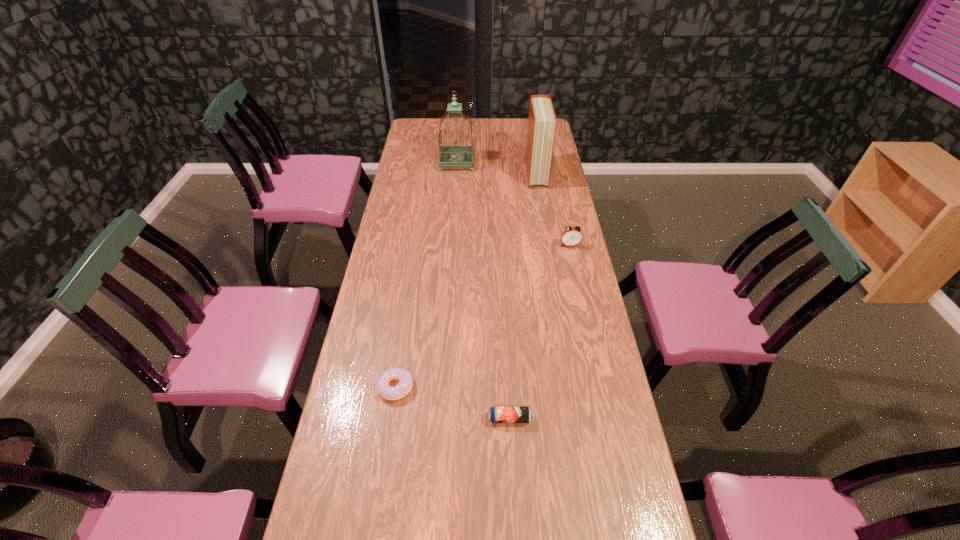
Find the location of a particular element. The height and width of the screenshot is (540, 960). birdcage is located at coordinates (451, 155).

This screenshot has height=540, width=960. In order to click on the second object from right to left in this screenshot , I will do `click(542, 121)`.

This screenshot has width=960, height=540. In order to click on alarm clock in this screenshot , I will do `click(572, 236)`.

The height and width of the screenshot is (540, 960). I want to click on the third farthest object, so click(x=572, y=236).

The width and height of the screenshot is (960, 540). In order to click on beer can in this screenshot , I will do `click(497, 414)`.

This screenshot has width=960, height=540. In order to click on the nearest object in this screenshot , I will do (497, 414).

Where is `doughnut`? This screenshot has width=960, height=540. doughnut is located at coordinates (405, 384).

Where is `free location located 0.070m at the door of the birdcage`? The image size is (960, 540). free location located 0.070m at the door of the birdcage is located at coordinates (489, 163).

Find the location of a particular element. The height and width of the screenshot is (540, 960). vacant space located on the open cover of the fourth object from left to right is located at coordinates (543, 217).

You are a GUI agent. You are given a task and a screenshot of the screen. Output one action in this format:
    pyautogui.click(x=<x>, y=<y>)
    Task: Click on the free space located on the clock face of the rightmost object
    
    Given the screenshot: What is the action you would take?
    pyautogui.click(x=581, y=293)